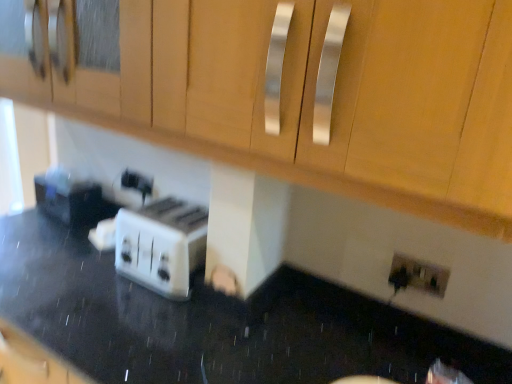
Question: Does white glossy toaster at lower left have a greater width compared to white plastic electric outlet at lower right?

Choices:
 (A) yes
 (B) no

Answer: (A)

Question: From a real-world perspective, is white glossy toaster at lower left beneath white plastic electric outlet at lower right?

Choices:
 (A) yes
 (B) no

Answer: (A)

Question: Considering the relative sizes of white glossy toaster at lower left and white plastic electric outlet at lower right in the image provided, is white glossy toaster at lower left taller than white plastic electric outlet at lower right?

Choices:
 (A) no
 (B) yes

Answer: (B)

Question: Is white glossy toaster at lower left turned away from white plastic electric outlet at lower right?

Choices:
 (A) no
 (B) yes

Answer: (A)

Question: Can we say white glossy toaster at lower left lies outside white plastic electric outlet at lower right?

Choices:
 (A) yes
 (B) no

Answer: (A)

Question: Is point pos(115,52) positioned closer to the camera than point pos(210,316)?

Choices:
 (A) farther
 (B) closer

Answer: (B)

Question: Based on their sizes in the image, would you say matte wood cabinet at upper center is bigger or smaller than white glossy toaster at lower left?

Choices:
 (A) small
 (B) big

Answer: (A)

Question: Is matte wood cabinet at upper center in front of or behind white glossy toaster at lower left in the image?

Choices:
 (A) front
 (B) behind

Answer: (A)

Question: Considering the positions of matte wood cabinet at upper center and white glossy toaster at lower left in the image, is matte wood cabinet at upper center taller or shorter than white glossy toaster at lower left?

Choices:
 (A) short
 (B) tall

Answer: (A)

Question: In the image, is white plastic toaster at center on the left side or the right side of white glossy toaster at lower left?

Choices:
 (A) right
 (B) left

Answer: (A)

Question: In terms of width, does white plastic toaster at center look wider or thinner when compared to white glossy toaster at lower left?

Choices:
 (A) thin
 (B) wide

Answer: (A)

Question: In the image, is white plastic toaster at center positioned in front of or behind white glossy toaster at lower left?

Choices:
 (A) behind
 (B) front

Answer: (A)

Question: From their relative heights in the image, would you say white plastic toaster at center is taller or shorter than white glossy toaster at lower left?

Choices:
 (A) tall
 (B) short

Answer: (B)

Question: Visually, is white glossy toaster at lower left positioned to the left or to the right of matte wood cabinet at upper center?

Choices:
 (A) right
 (B) left

Answer: (B)

Question: From a real-world perspective, relative to matte wood cabinet at upper center, is white glossy toaster at lower left vertically above or below?

Choices:
 (A) below
 (B) above

Answer: (A)